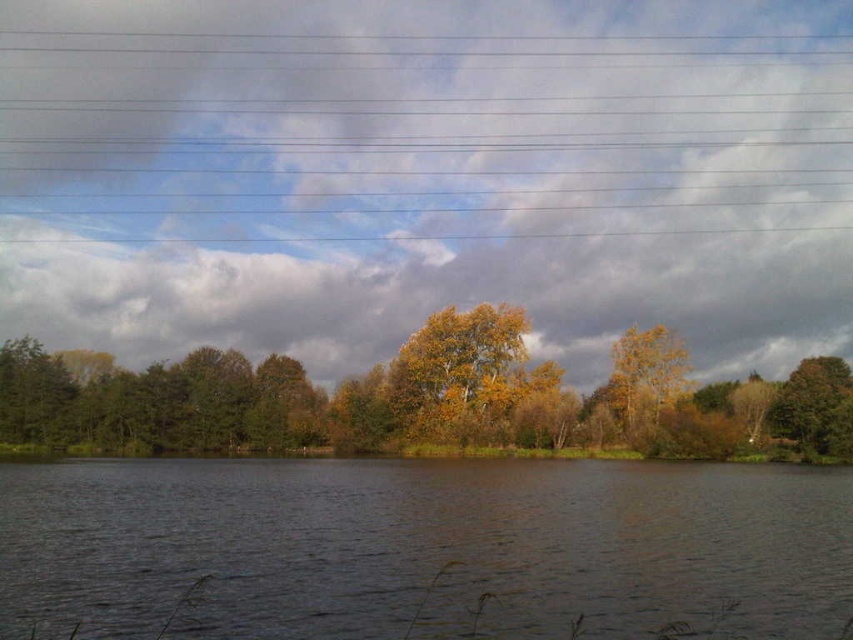
Between golden-brown bark tree at center and yellow leafy tree at right, which one is positioned higher?

Positioned higher is golden-brown bark tree at center.

Is the position of golden-brown bark tree at center more distant than that of yellow leafy tree at right?

Yes, golden-brown bark tree at center is further from the viewer.

Between point (439, 412) and point (657, 404), which one is positioned behind?

The point (439, 412) is more distant.

Find the location of a particular element. The image size is (853, 640). golden-brown bark tree at center is located at coordinates (459, 372).

Can you confirm if dark water at center is thinner than golden-brown bark tree at center?

No, dark water at center is not thinner than golden-brown bark tree at center.

Is point (648, 609) closer to camera compared to point (514, 314)?

Yes.

Describe the element at coordinates (422, 548) in the screenshot. Image resolution: width=853 pixels, height=640 pixels. I see `dark water at center` at that location.

Where is `dark water at center`? dark water at center is located at coordinates (422, 548).

Is cloudy sky at upper center above golden-brown bark tree at center?

Yes, cloudy sky at upper center is above golden-brown bark tree at center.

Locate an element on the screen. Image resolution: width=853 pixels, height=640 pixels. cloudy sky at upper center is located at coordinates (427, 176).

The image size is (853, 640). What do you see at coordinates (427, 176) in the screenshot? I see `cloudy sky at upper center` at bounding box center [427, 176].

Find the location of a particular element. cloudy sky at upper center is located at coordinates (427, 176).